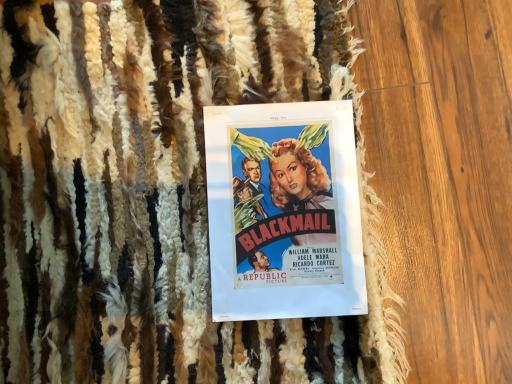
Question: Should I look upward or downward to see vivid paper poster at center?

Choices:
 (A) up
 (B) down

Answer: (B)